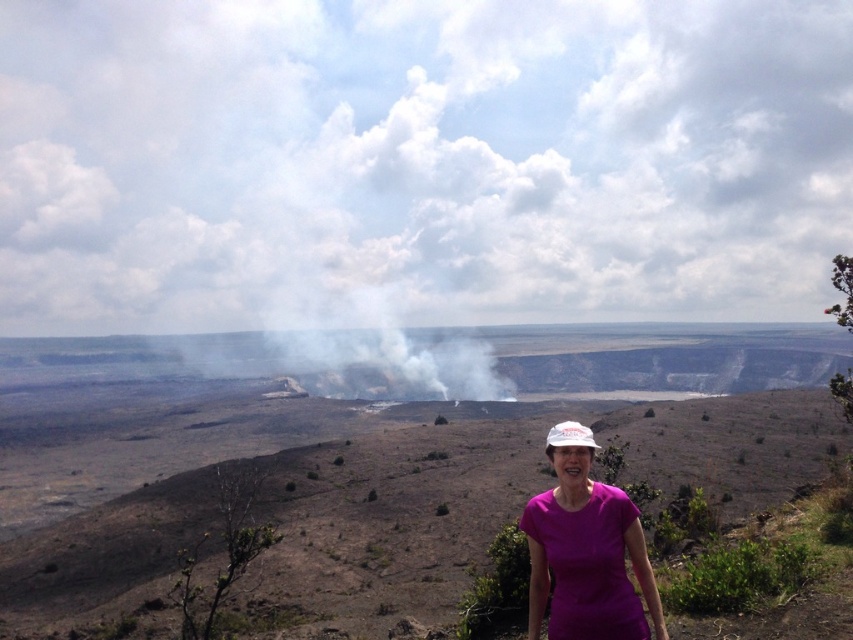
You are a tour guide leading a group at the Kilauea Caldera. A visitor asks if they can safely approach the edge of the crater from their current position near the purple matte shirt at lower center. Based on the distance provided, what would you advise?

The purple matte shirt at lower center is 7.08 meters away from the camera. Since the shirt is part of the visitor standing on a rocky outcrop, the edge of the crater is likely beyond this distance. However, without knowing the exact distance to the edge, it is safer to advise visitors not to approach the crater edge without official guidance.

You are a photographer aiming to capture the person in the image. The camera is focused on the white fabric hat at center. Will the purple matte shirt at lower center also be in focus?

The purple matte shirt at lower center is positioned over the white fabric hat at center, so yes, the purple matte shirt at lower center will be in focus since it is directly above the focused area.

You are a photographer aiming to capture the volcanic crater with both the purple matte shirt at lower center and the white fabric hat at center in the frame. Which object should you position closer to the left side of your camera viewfinder to ensure both are included?

To include both the purple matte shirt at lower center and the white fabric hat at center in the frame, position the purple matte shirt at lower center closer to the left side of the camera viewfinder since it is already to the left of the white fabric hat at center.